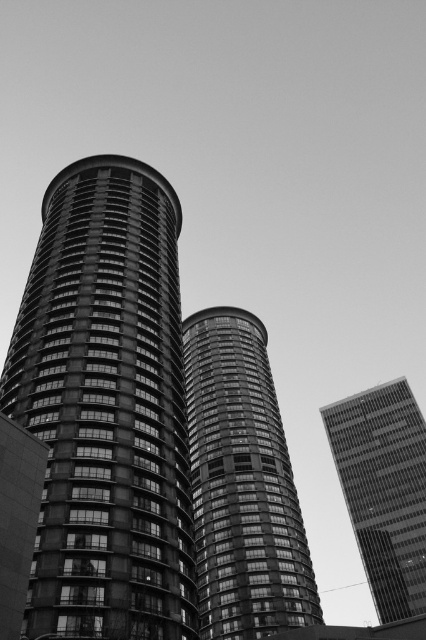
Question: Can you confirm if smooth glass tower at center is bigger than smooth glass windows at center?

Choices:
 (A) no
 (B) yes

Answer: (B)

Question: Which point appears closest to the camera in this image?

Choices:
 (A) (154, 268)
 (B) (405, 458)
 (C) (34, 520)
 (D) (206, 444)

Answer: (C)

Question: Which object is the closest to the smooth glass tower at center?

Choices:
 (A) concrete tower at center
 (B) smooth glass skyscraper at center
 (C) smooth glass windows at center

Answer: (A)

Question: Is smooth glass skyscraper at center to the right of smooth glass windows at center from the viewer's perspective?

Choices:
 (A) no
 (B) yes

Answer: (B)

Question: Where is smooth glass tower at center located in relation to smooth glass skyscraper at center in the image?

Choices:
 (A) above
 (B) below

Answer: (A)

Question: Considering the real-world distances, which object is farthest from the smooth glass tower at center?

Choices:
 (A) smooth glass skyscraper at center
 (B) smooth glass windows at center

Answer: (B)